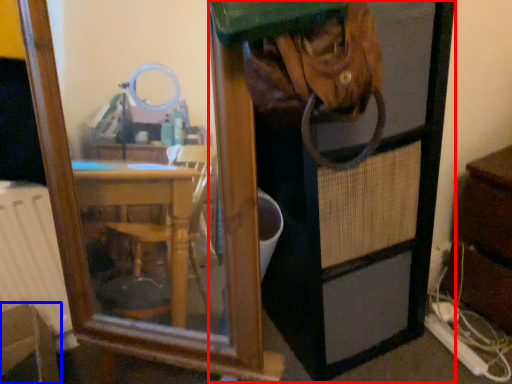
Question: Which object appears closest to the camera in this image, screen door (highlighted by a red box) or furniture (highlighted by a blue box)?

Choices:
 (A) screen door
 (B) furniture

Answer: (A)